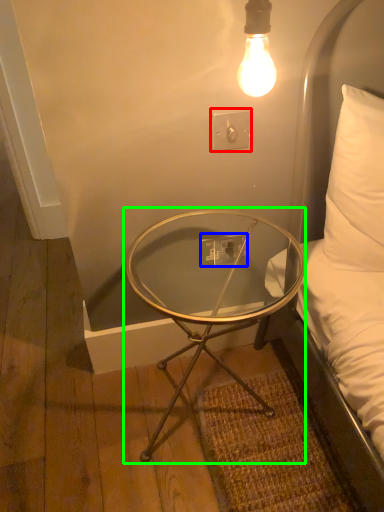
Question: Which object is the closest to the electric outlet (highlighted by a red box)? Choose among these: electric outlet (highlighted by a blue box) or coffee table (highlighted by a green box).

Choices:
 (A) electric outlet
 (B) coffee table

Answer: (A)